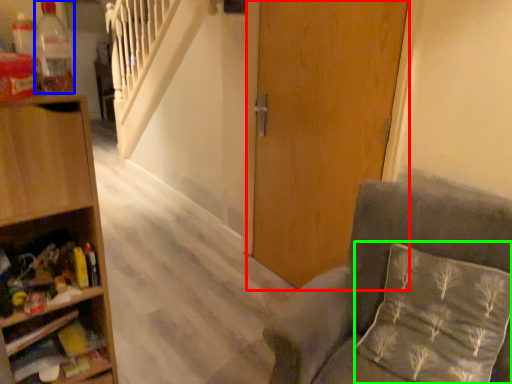
Question: Based on their relative distances, which object is nearer to door (highlighted by a red box)? Choose from bottle (highlighted by a blue box) and pillow (highlighted by a green box).

Choices:
 (A) bottle
 (B) pillow

Answer: (B)